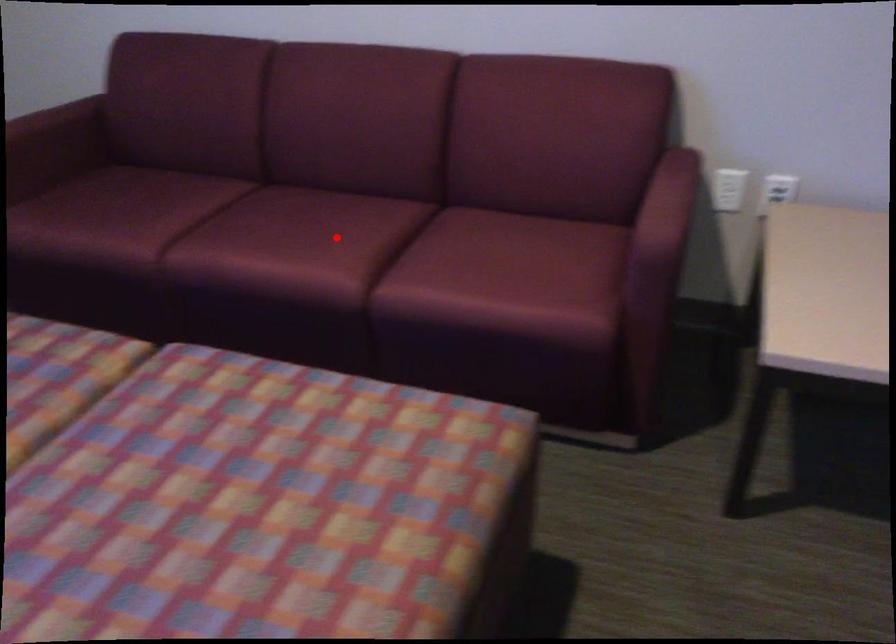
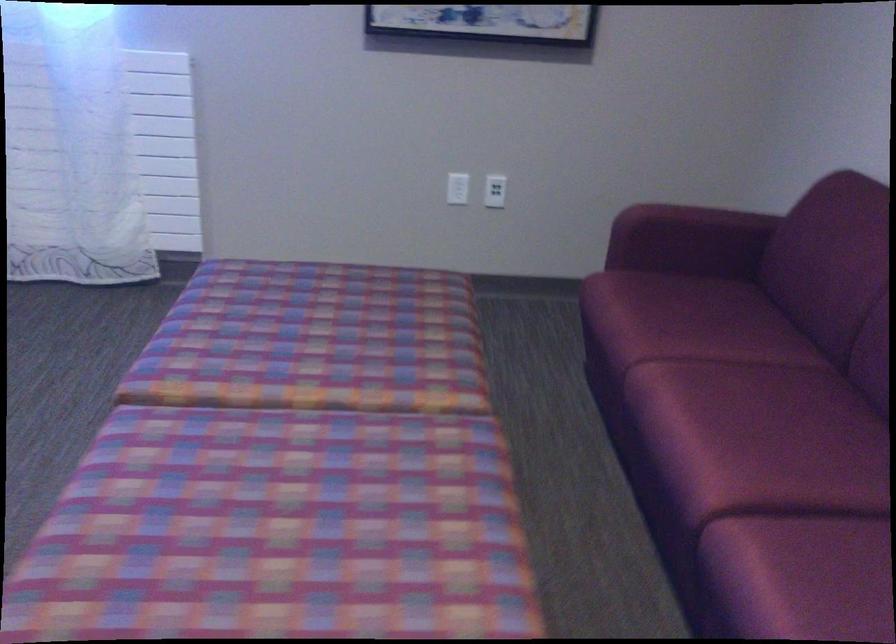
Find the pixel in the second image that matches the highlighted location in the first image.

(764, 456)